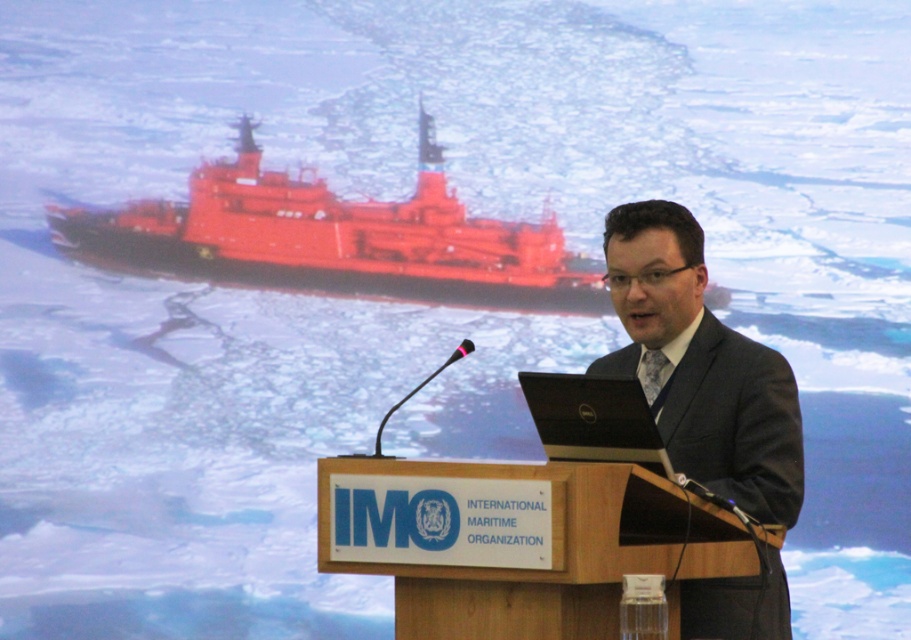
Which of these two, metallic red ship at center or dark gray suit at center, stands taller?

dark gray suit at center is taller.

From the picture: Can you confirm if metallic red ship at center is taller than dark gray suit at center?

No, metallic red ship at center is not taller than dark gray suit at center.

The height and width of the screenshot is (640, 911). What do you see at coordinates (336, 237) in the screenshot? I see `metallic red ship at center` at bounding box center [336, 237].

The width and height of the screenshot is (911, 640). What are the coordinates of `metallic red ship at center` in the screenshot? It's located at (336, 237).

Does point (344, 502) come behind point (746, 621)?

No, (344, 502) is in front of (746, 621).

Who is shorter, wooden podium at center or dark gray suit at center?

wooden podium at center

Is point (681, 499) farther from viewer compared to point (640, 314)?

No.

The image size is (911, 640). Identify the location of wooden podium at center. (520, 541).

Between wooden podium at center and metallic red ship at center, which one appears on the right side from the viewer's perspective?

Positioned to the right is wooden podium at center.

Can you confirm if wooden podium at center is bigger than metallic red ship at center?

No.

This screenshot has height=640, width=911. Find the location of `wooden podium at center`. wooden podium at center is located at coordinates (520, 541).

Find the location of a particular element. wooden podium at center is located at coordinates (520, 541).